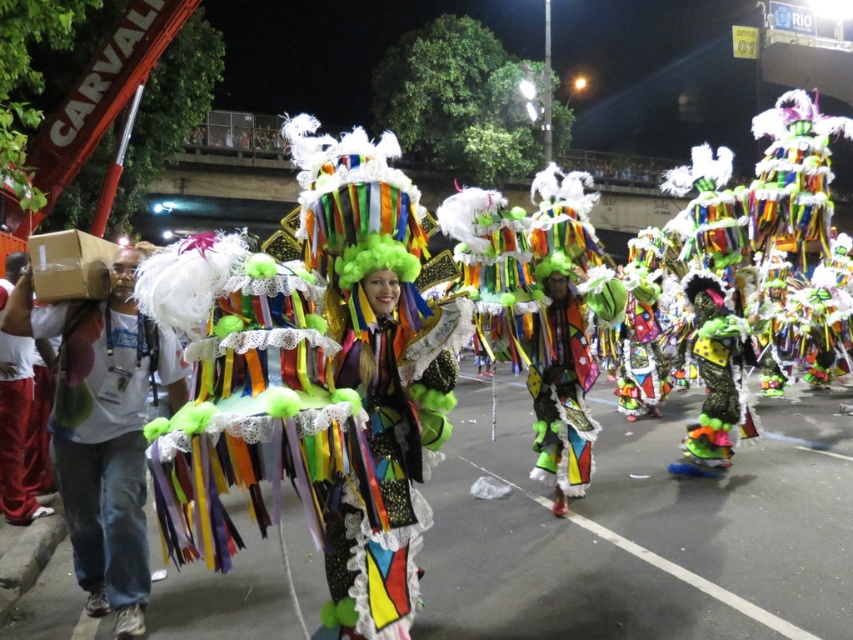
You are a performer in the parade and you want to retrieve your velvet red pants at left. However, there is a brown cardboard box at left blocking your path. Can you reach your pants without moving the box?

The brown cardboard box at left is in front of velvet red pants at left, so you cannot reach the velvet red pants at left without moving the box.

You are standing at the center of the street and see the point at coordinates [103,429]. Which object is this point located on?

The point at coordinates [103,429] is located on the brown cardboard box at left.